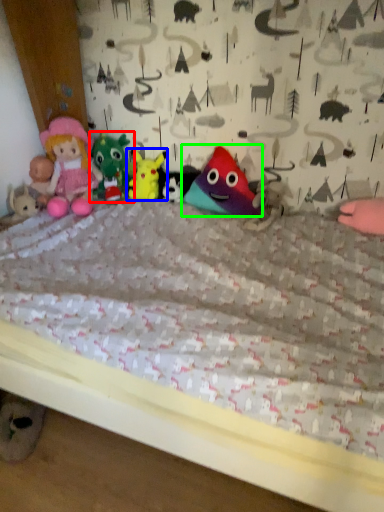
Question: Which object is positioned closest to toy (highlighted by a red box)? Select from toy (highlighted by a blue box) and toy (highlighted by a green box).

Choices:
 (A) toy
 (B) toy

Answer: (A)